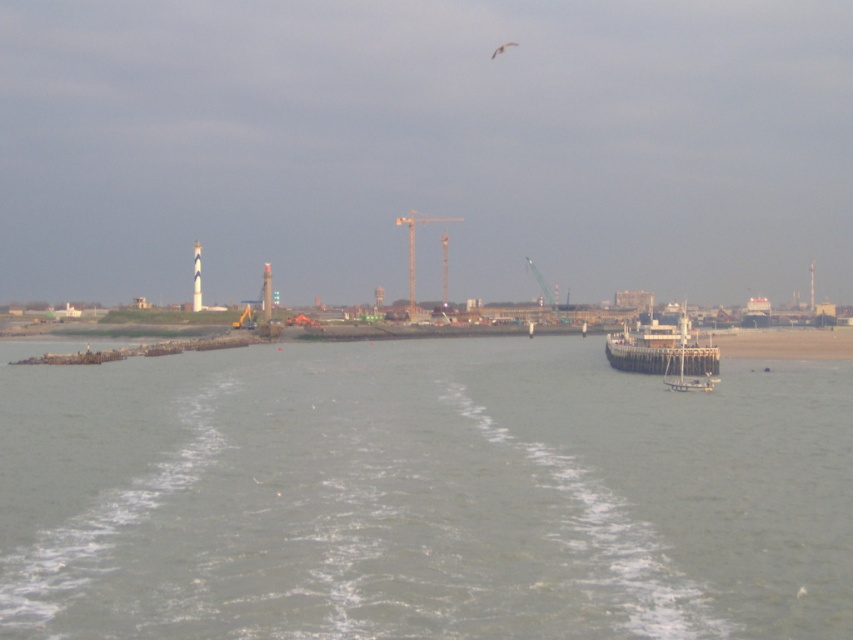
You are on a boat and want to know if the white wooden ship at center is between you and the metallic yellow crane at center. Based on the scene, can you determine this?

Yes, the white wooden ship at center is closer to the viewer than the metallic yellow crane at center, meaning it is between you and the crane.

You are on a boat and looking at the scene. The gray water at center and the white wooden ship at center are both in your view. Which one is closer to the bottom of the image?

The gray water at center is below the white wooden ship at center, so the gray water at center is closer to the bottom of the image.

You are the captain of a boat that is 10 meters long. You want to navigate through the gray water at center. Can your boat fit through the space provided?

The gray water at center is 12.77 meters from viewer. Since the boat is 10 meters long, it can fit through the space as the distance is greater than the boat length.